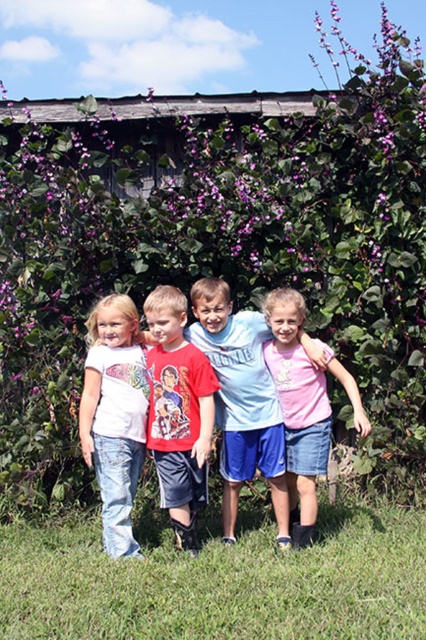
You are a photographer setting up for a group photo. You need to ensure that the light blue cotton shirt at center and the white denim jeans at left are in focus. Given that your camera can focus on objects within a 75 cm range, will both subjects be in focus?

The light blue cotton shirt at center is 77.30 centimeters away from the white denim jeans at left. Since the distance between them exceeds the camera focus range of 75 cm, they might not both be in focus simultaneously.